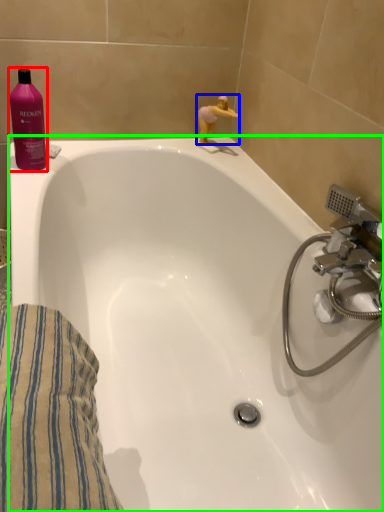
Question: Which is nearer to the cleaning product (highlighted by a red box)? miniature (highlighted by a blue box) or bathtub (highlighted by a green box).

Choices:
 (A) miniature
 (B) bathtub

Answer: (B)